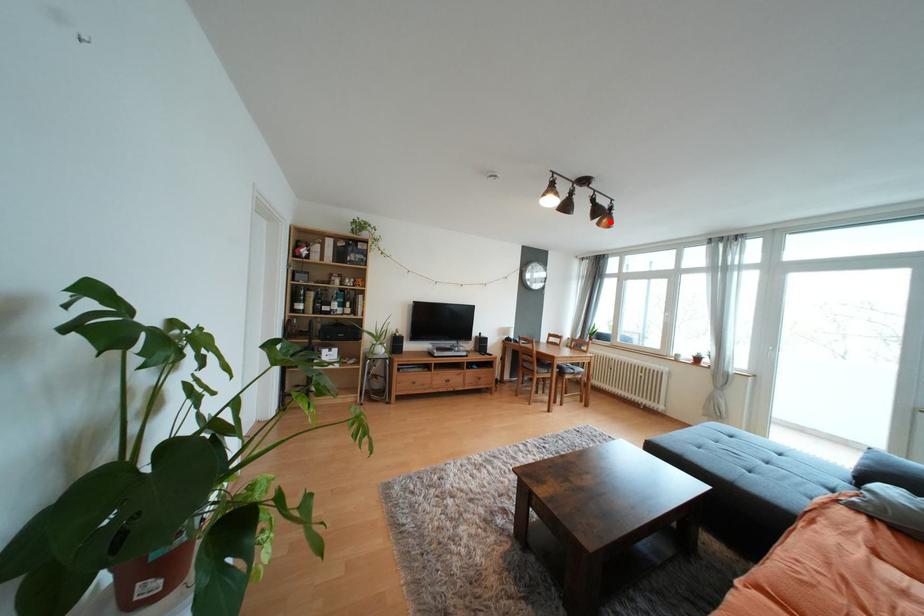
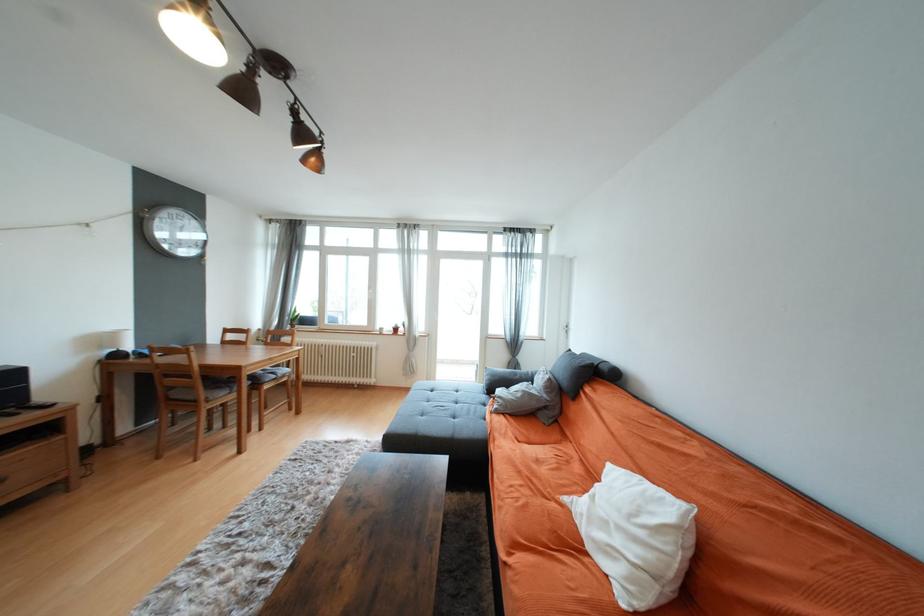
In the second image, find the point that corresponds to the highlighted location in the first image.

(319, 161)